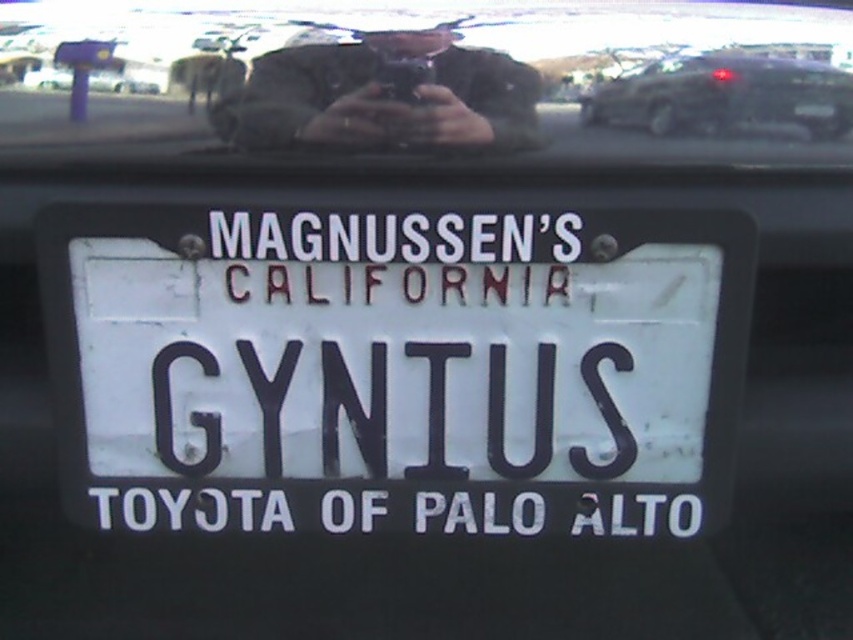
How far apart are matte black phone at upper center and metallic dark gray suv at upper right?

They are 9.08 inches apart.

Which of these two, matte black phone at upper center or metallic dark gray suv at upper right, stands taller?

matte black phone at upper center is taller.

Is point (311, 76) positioned in front of point (830, 84)?

Yes, it is in front of point (830, 84).

Where is `matte black phone at upper center`? matte black phone at upper center is located at coordinates (386, 93).

Between point (590, 452) and point (811, 72), which one is positioned in front?

Point (811, 72) is more forward.

Is point (62, 436) closer to viewer compared to point (804, 136)?

No, (62, 436) is behind (804, 136).

Locate an element on the screen. This screenshot has width=853, height=640. white matte license plate at center is located at coordinates [397, 369].

Is white matte license plate at center smaller than metallic dark gray suv at upper right?

Incorrect, white matte license plate at center is not smaller in size than metallic dark gray suv at upper right.

Does white matte license plate at center appear over metallic dark gray suv at upper right?

Actually, white matte license plate at center is below metallic dark gray suv at upper right.

I want to click on white matte license plate at center, so pyautogui.click(x=397, y=369).